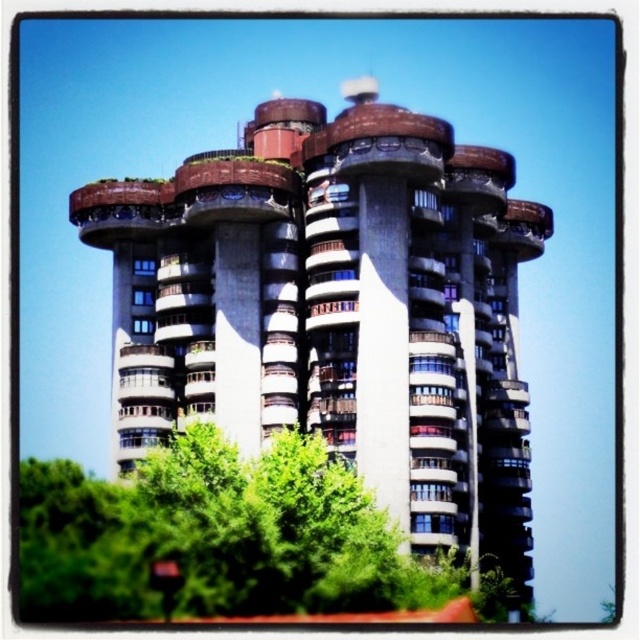
Question: Among these points, which one is nearest to the camera?

Choices:
 (A) (195, 390)
 (B) (240, 472)

Answer: (B)

Question: Does concrete building at center come in front of green leafy tree at lower center?

Choices:
 (A) no
 (B) yes

Answer: (A)

Question: Does concrete building at center have a greater width compared to green leafy tree at lower center?

Choices:
 (A) yes
 (B) no

Answer: (B)

Question: Among these points, which one is farthest from the camera?

Choices:
 (A) (216, 356)
 (B) (54, 548)

Answer: (A)

Question: Among these objects, which one is nearest to the camera?

Choices:
 (A) concrete building at center
 (B) green leafy tree at lower center

Answer: (B)

Question: Is concrete building at center to the left of green leafy tree at lower center from the viewer's perspective?

Choices:
 (A) no
 (B) yes

Answer: (A)